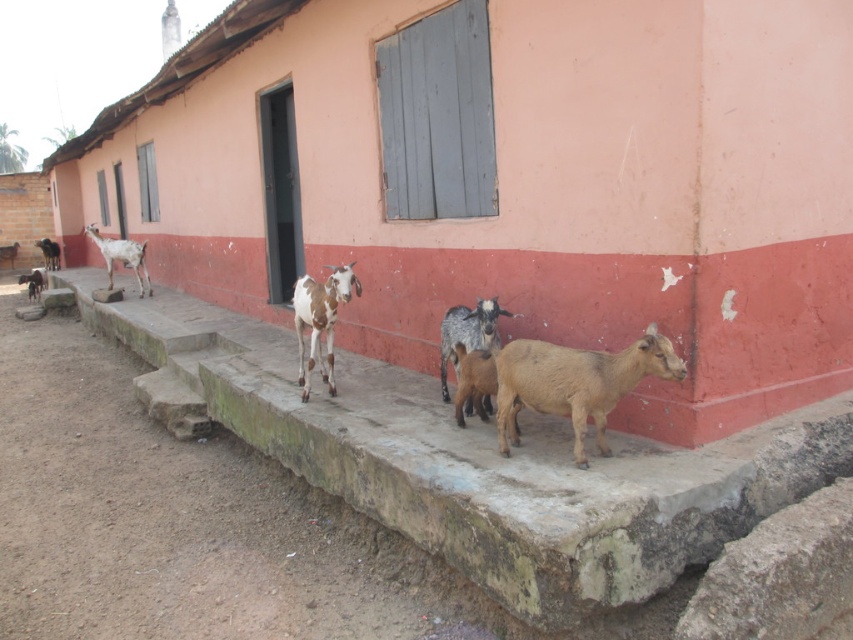
Is brown speckled fur goat at center taller than brown speckled goat at lower left?

Correct, brown speckled fur goat at center is much taller as brown speckled goat at lower left.

Can you confirm if brown speckled fur goat at center is shorter than brown speckled goat at lower left?

No, brown speckled fur goat at center is not shorter than brown speckled goat at lower left.

Where is `brown speckled fur goat at center`? Image resolution: width=853 pixels, height=640 pixels. brown speckled fur goat at center is located at coordinates (468, 333).

Where is `concrete ledge at center`? This screenshot has width=853, height=640. concrete ledge at center is located at coordinates (474, 461).

Who is taller, brown woolen goat at center or white spotted fur goat at center?

white spotted fur goat at center

Is brown woolen goat at center closer to the viewer compared to white spotted fur goat at center?

Yes, it is.

Does point (605, 444) come farther from viewer compared to point (329, 328)?

No, (605, 444) is closer to viewer.

The width and height of the screenshot is (853, 640). Find the location of `brown woolen goat at center`. brown woolen goat at center is located at coordinates (575, 381).